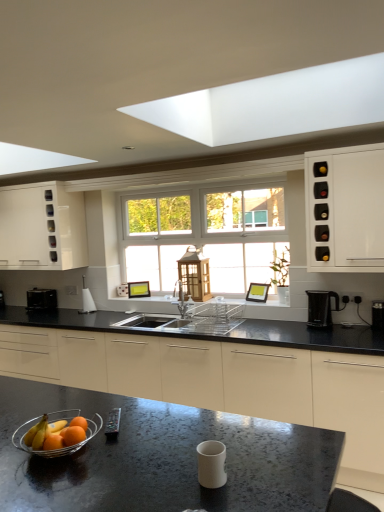
The height and width of the screenshot is (512, 384). What do you see at coordinates (87, 300) in the screenshot?
I see `white glossy trash can at left, which is counted as the 2th appliance, starting from the back` at bounding box center [87, 300].

This screenshot has width=384, height=512. In order to click on matte black toaster at left, marked as the fifth appliance in a right-to-left arrangement in this screenshot , I will do `click(41, 298)`.

The image size is (384, 512). In order to click on clear glass bowl at lower left in this screenshot , I will do `click(59, 448)`.

In order to face black plastic coffee maker at right, which is the 1th appliance in right-to-left order, should I rotate leftwards or rightwards?

You should look right and rotate roughly 23.924 degrees.

Find the location of a particular element. This screenshot has width=384, height=512. white glossy cabinet at upper left, which is counted as the second cabinetry, starting from the front is located at coordinates (42, 228).

Considering the relative sizes of white glossy cabinet at upper left, which ranks as the 1th cabinetry in left-to-right order, and metallic remote control at center, the 4th appliance viewed from the back, in the image provided, is white glossy cabinet at upper left, which ranks as the 1th cabinetry in left-to-right order, bigger than metallic remote control at center, the 4th appliance viewed from the back,?

Correct, white glossy cabinet at upper left, which ranks as the 1th cabinetry in left-to-right order, is larger in size than metallic remote control at center, the 4th appliance viewed from the back.

Can you confirm if white glossy cabinet at upper left, the 1th cabinetry when ordered from back to front, is positioned to the right of metallic remote control at center, which is the second appliance from front to back?

Incorrect, white glossy cabinet at upper left, the 1th cabinetry when ordered from back to front, is not on the right side of metallic remote control at center, which is the second appliance from front to back.

Considering the positions of objects white glossy cabinet at upper left, the 1th cabinetry when ordered from back to front, and metallic remote control at center, the 4th appliance viewed from the back, in the image provided, who is behind, white glossy cabinet at upper left, the 1th cabinetry when ordered from back to front, or metallic remote control at center, the 4th appliance viewed from the back,?

Positioned behind is white glossy cabinet at upper left, the 1th cabinetry when ordered from back to front.

From the picture: From a real-world perspective, is white glossy cabinet at upper left, which is counted as the second cabinetry, starting from the front, over metallic remote control at center, which ranks as the 3th appliance in left-to-right order?

Yes, from a real-world perspective, white glossy cabinet at upper left, which is counted as the second cabinetry, starting from the front, is on top of metallic remote control at center, which ranks as the 3th appliance in left-to-right order.

Which of these two, black plastic coffee machine at right or metallic silver faucet at center, stands shorter?

black plastic coffee machine at right.

Locate an element on the screen. coffee machine lying on the right of metallic silver faucet at center is located at coordinates (321, 308).

Which is more to the left, black plastic coffee machine at right or metallic silver faucet at center?

From the viewer's perspective, metallic silver faucet at center appears more on the left side.

Is white glossy cabinet at upper left, the 1th cabinetry when ordered from back to front, turned away from white glossy cabinet at right, which is counted as the 2th cabinetry, starting from the left?

No.

Does white glossy cabinet at upper left, which is counted as the second cabinetry, starting from the front, come in front of white glossy cabinet at right, acting as the second cabinetry starting from the back?

No, it is not.

Considering the sizes of objects white glossy cabinet at upper left, which is counted as the second cabinetry, starting from the front, and white glossy cabinet at right, arranged as the first cabinetry when viewed from the front, in the image provided, who is shorter, white glossy cabinet at upper left, which is counted as the second cabinetry, starting from the front, or white glossy cabinet at right, arranged as the first cabinetry when viewed from the front,?

white glossy cabinet at right, arranged as the first cabinetry when viewed from the front.

How many degrees apart are the facing directions of white glossy trash can at left, the 4th appliance in the front-to-back sequence, and metallic silver faucet at center?

The facing directions of white glossy trash can at left, the 4th appliance in the front-to-back sequence, and metallic silver faucet at center are 0.749 degrees apart.

Looking at the image, does white glossy trash can at left, the second appliance from the left, seem bigger or smaller compared to metallic silver faucet at center?

In the image, white glossy trash can at left, the second appliance from the left, appears to be smaller than metallic silver faucet at center.

Relative to metallic silver faucet at center, is white glossy trash can at left, the second appliance from the left, in front or behind?

white glossy trash can at left, the second appliance from the left, is positioned farther from the viewer than metallic silver faucet at center.

Does white glossy trash can at left, which is the fourth appliance in right-to-left order, touch metallic silver faucet at center?

white glossy trash can at left, which is the fourth appliance in right-to-left order, and metallic silver faucet at center are not in contact.

Does metallic silver faucet at center have a smaller size compared to black plastic coffee maker at right, which is the 1th appliance in right-to-left order?

No.

From a real-world perspective, which is physically below, metallic silver faucet at center or black plastic coffee maker at right, which is counted as the fifth appliance, starting from the left?

black plastic coffee maker at right, which is counted as the fifth appliance, starting from the left, is physically lower.

The image size is (384, 512). Find the location of `tap positioned vertically above the black plastic coffee maker at right, which is counted as the fifth appliance, starting from the left (from a real-world perspective)`. tap positioned vertically above the black plastic coffee maker at right, which is counted as the fifth appliance, starting from the left (from a real-world perspective) is located at coordinates (181, 298).

Is metallic silver faucet at center outside of clear glass bowl at lower left?

Indeed, metallic silver faucet at center is completely outside clear glass bowl at lower left.

Is metallic silver faucet at center in front of or behind clear glass bowl at lower left in the image?

metallic silver faucet at center is positioned farther from the viewer than clear glass bowl at lower left.

From the image's perspective, relative to clear glass bowl at lower left, is metallic silver faucet at center above or below?

Based on their image positions, metallic silver faucet at center is located above clear glass bowl at lower left.

Is metallic remote control at center, the 3th appliance positioned from the right, positioned far away from white glossy cabinet at right, acting as the second cabinetry starting from the back?

Indeed, metallic remote control at center, the 3th appliance positioned from the right, is not near white glossy cabinet at right, acting as the second cabinetry starting from the back.

From the picture: From a real-world perspective, is metallic remote control at center, which ranks as the 3th appliance in left-to-right order, under white glossy cabinet at right, which is counted as the 2th cabinetry, starting from the left?

Indeed, from a real-world perspective, metallic remote control at center, which ranks as the 3th appliance in left-to-right order, is positioned beneath white glossy cabinet at right, which is counted as the 2th cabinetry, starting from the left.

At what (x,y) coordinates should I click in order to perform the action: click on cabinetry on the right side of metallic remote control at center, which ranks as the 3th appliance in left-to-right order. Please return your answer as a coordinate pair (x, y). The image size is (384, 512). Looking at the image, I should click on (345, 209).

From a real-world perspective, starting from the metallic remote control at center, the 4th appliance viewed from the back, which cabinetry is the 2nd one vertically above it? Please provide its 2D coordinates.

[(42, 228)]

This screenshot has width=384, height=512. Find the location of `coffee machine beneath the metallic silver faucet at center (from a real-world perspective)`. coffee machine beneath the metallic silver faucet at center (from a real-world perspective) is located at coordinates (321, 308).

Estimate the real-world distances between objects in this image. Which object is closer to white glossy trash can at left, which is counted as the 2th appliance, starting from the back, white glossy cabinet at right, arranged as the first cabinetry when viewed from the front, or black plastic coffee machine at right?

A: black plastic coffee machine at right is positioned closer to the anchor white glossy trash can at left, which is counted as the 2th appliance, starting from the back.

Looking at this image, from the image, which object appears to be nearer to white glossy cabinet at right, acting as the second cabinetry starting from the back, matte black toaster at left, positioned as the 5th appliance in front-to-back order, or white glossy trash can at left, the second appliance from the left?

white glossy trash can at left, the second appliance from the left.

When comparing their distances from matte black toaster at left, positioned as the 5th appliance in front-to-back order, does white glossy trash can at left, the 4th appliance in the front-to-back sequence, or metallic remote control at center, which is the second appliance from front to back, seem further?

metallic remote control at center, which is the second appliance from front to back, lies further to matte black toaster at left, positioned as the 5th appliance in front-to-back order, than the other object.

Based on their spatial positions, is matte black toaster at left, marked as the fifth appliance in a right-to-left arrangement, or white glossy cabinet at upper left, which is counted as the second cabinetry, starting from the front, closer to clear glass bowl at lower left?

The object closer to clear glass bowl at lower left is matte black toaster at left, marked as the fifth appliance in a right-to-left arrangement.

Which object lies further to the anchor point white glossy cabinet at upper left, which ranks as the 1th cabinetry in left-to-right order, white matte cup at center, the second appliance positioned from the right, or white glossy cabinet at right, which is counted as the 1th cabinetry, starting from the right?

white matte cup at center, the second appliance positioned from the right, lies further to white glossy cabinet at upper left, which ranks as the 1th cabinetry in left-to-right order, than the other object.

From the image, which object appears to be nearer to black granite countertop at center, white glossy trash can at left, the second appliance from the left, or matte black toaster at left, which is counted as the 1th appliance, starting from the left?

matte black toaster at left, which is counted as the 1th appliance, starting from the left, is positioned closer to the anchor black granite countertop at center.

Considering their positions, is clear glass bowl at lower left positioned closer to matte black toaster at left, positioned as the 5th appliance in front-to-back order, than black granite countertop at center?

The object closer to matte black toaster at left, positioned as the 5th appliance in front-to-back order, is black granite countertop at center.

Estimate the real-world distances between objects in this image. Which object is closer to black plastic coffee maker at right, which appears as the 3th appliance when viewed from the back, white glossy cabinet at right, acting as the second cabinetry starting from the back, or black granite countertop at center?

white glossy cabinet at right, acting as the second cabinetry starting from the back, lies closer to black plastic coffee maker at right, which appears as the 3th appliance when viewed from the back, than the other object.

Locate an element on the screen. This screenshot has width=384, height=512. tap between white glossy cabinet at upper left, the 1th cabinetry when ordered from back to front, and black plastic coffee machine at right is located at coordinates (181, 298).

At what (x,y) coordinates should I click in order to perform the action: click on cabinetry between metallic remote control at center, which ranks as the 3th appliance in left-to-right order, and black plastic coffee maker at right, the third appliance from the front. Please return your answer as a coordinate pair (x, y). The height and width of the screenshot is (512, 384). Looking at the image, I should click on (345, 209).

The image size is (384, 512). Find the location of `coffee machine between white matte cup at center, the second appliance positioned from the right, and metallic silver faucet at center from front to back`. coffee machine between white matte cup at center, the second appliance positioned from the right, and metallic silver faucet at center from front to back is located at coordinates (321, 308).

Where is `countertop located between clear glass bowl at lower left and white glossy trash can at left, which is the fourth appliance in right-to-left order, in the depth direction`? This screenshot has height=512, width=384. countertop located between clear glass bowl at lower left and white glossy trash can at left, which is the fourth appliance in right-to-left order, in the depth direction is located at coordinates (218, 372).